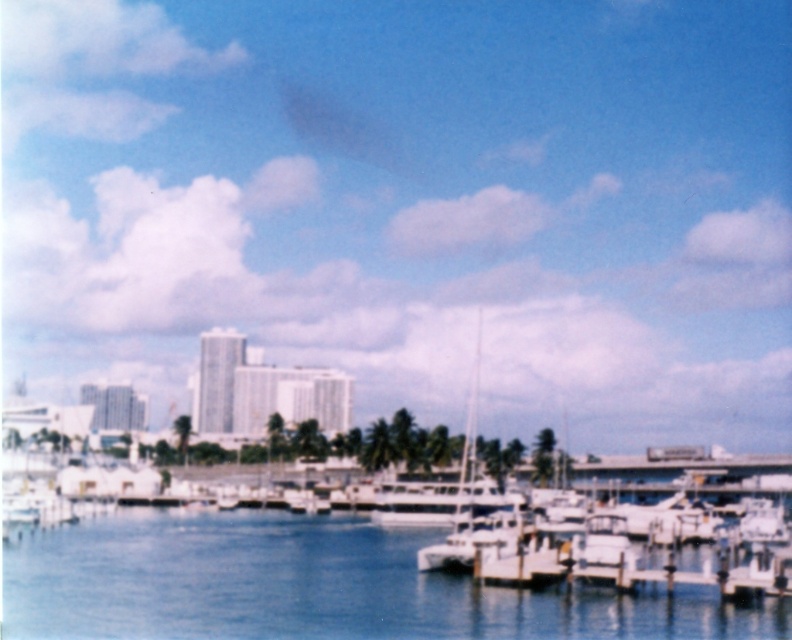
Can you confirm if clear blue water at center is shorter than white glossy sailboat at center?

Yes.

Which is in front, point (109, 545) or point (419, 557)?

Point (419, 557)

You are a GUI agent. You are given a task and a screenshot of the screen. Output one action in this format:
    pyautogui.click(x=<x>, y=<y>)
    Task: Click on the clear blue water at center
    
    Given the screenshot: What is the action you would take?
    pyautogui.click(x=311, y=586)